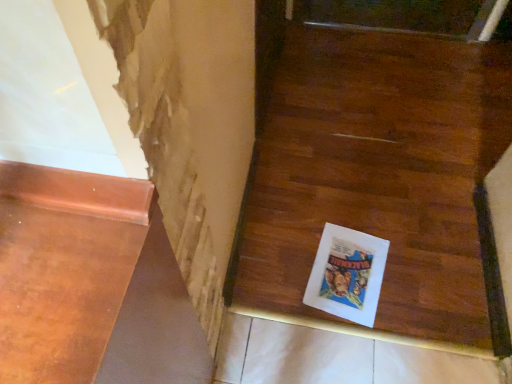
At what (x,y) coordinates should I click in order to perform the action: click on wooden at lower right. Please return your answer as a coordinate pair (x, y). This screenshot has height=384, width=512. Looking at the image, I should click on (380, 181).

The image size is (512, 384). What do you see at coordinates (380, 181) in the screenshot?
I see `wooden at lower right` at bounding box center [380, 181].

Identify the location of wooden at lower right. This screenshot has height=384, width=512. (380, 181).